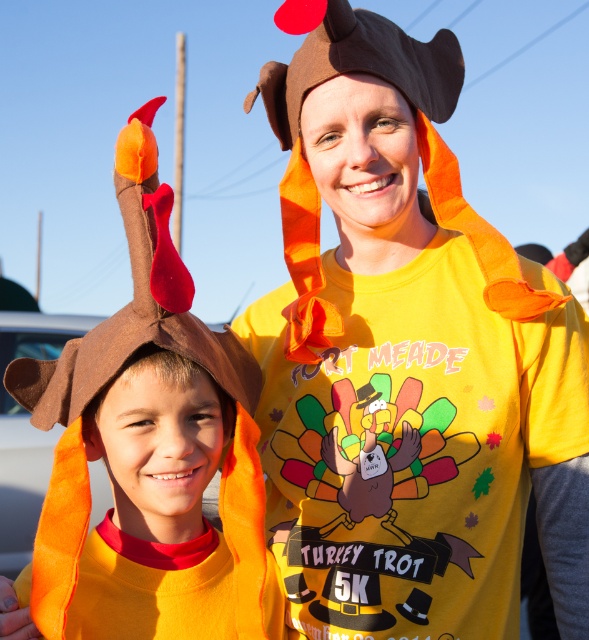
You are a participant in the Turkey Trot 5K and notice two turkey hats in the crowd. The matte brown turkey hat at center and the felt turkey hat at left. Which one is positioned to the right of the other?

The matte brown turkey hat at center is positioned to the right of the felt turkey hat at left.

You are a photographer positioned behind the runners. You need to take a photo of both the matte brown turkey hat at center and the felt turkey hat at left. Which hat will appear closer to the camera in the photo?

The matte brown turkey hat at center will appear closer to the camera because it is positioned further to the viewer compared to the felt turkey hat at left.